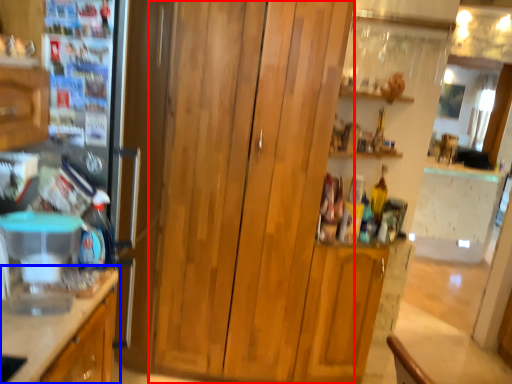
Question: Which point is closer to the camera, dresser (highlighted by a red box) or cabinetry (highlighted by a blue box)?

Choices:
 (A) dresser
 (B) cabinetry

Answer: (B)